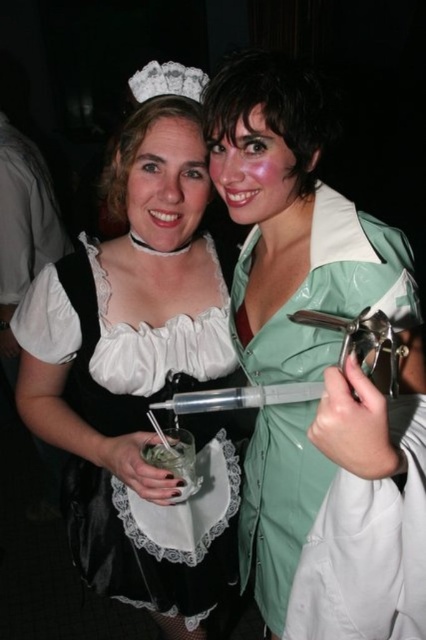
Who is more distant from viewer, [180,202] or [265,230]?

Point [265,230]

Does white lace dress at center have a lesser height compared to green shiny syringe at center?

No.

Identify the location of white lace dress at center. The image size is (426, 640). (141, 369).

You are a GUI agent. You are given a task and a screenshot of the screen. Output one action in this format:
    pyautogui.click(x=<x>, y=<y>)
    Task: Click on the white lace dress at center
    This screenshot has height=640, width=426.
    Given the screenshot: What is the action you would take?
    pyautogui.click(x=141, y=369)